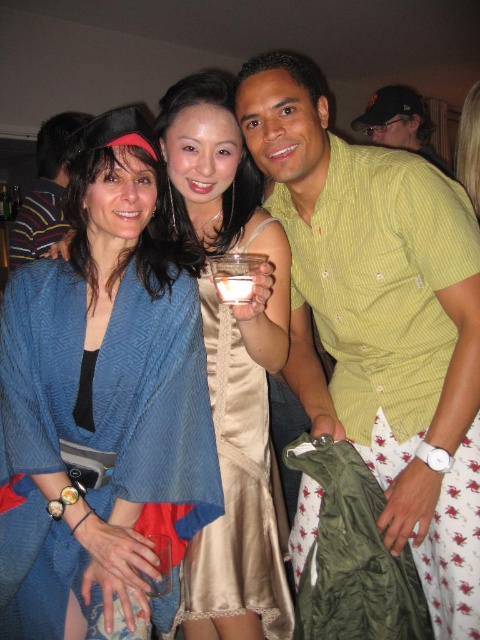
Identify the location of green striped shirt at center. (381, 320).

Is point (391, 476) positioned before point (1, 410)?

No, it is not.

This screenshot has height=640, width=480. What are the coordinates of `green striped shirt at center` in the screenshot? It's located at (381, 320).

Which is below, blue silk kimono at left or striped cotton shirt at center?

blue silk kimono at left

Between blue silk kimono at left and striped cotton shirt at center, which one appears on the left side from the viewer's perspective?

striped cotton shirt at center

Where is `blue silk kimono at left`? The width and height of the screenshot is (480, 640). blue silk kimono at left is located at coordinates (232, 365).

Can you confirm if blue cotton robe at left is positioned to the left of clear plastic cup at center?

Indeed, blue cotton robe at left is positioned on the left side of clear plastic cup at center.

Between point (43, 221) and point (255, 253), which one is positioned in front?

Point (255, 253) is more forward.

Which is in front, point (60, 225) or point (252, 282)?

Point (252, 282) is more forward.

At what (x,y) coordinates should I click in order to perform the action: click on blue cotton robe at left. Please return your answer as a coordinate pair (x, y). This screenshot has width=480, height=640. Looking at the image, I should click on (37, 221).